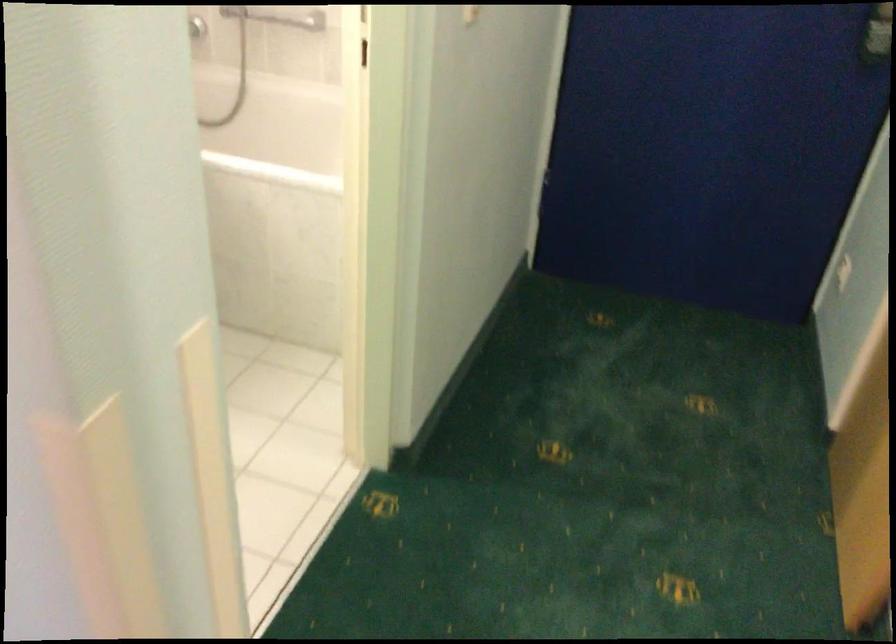
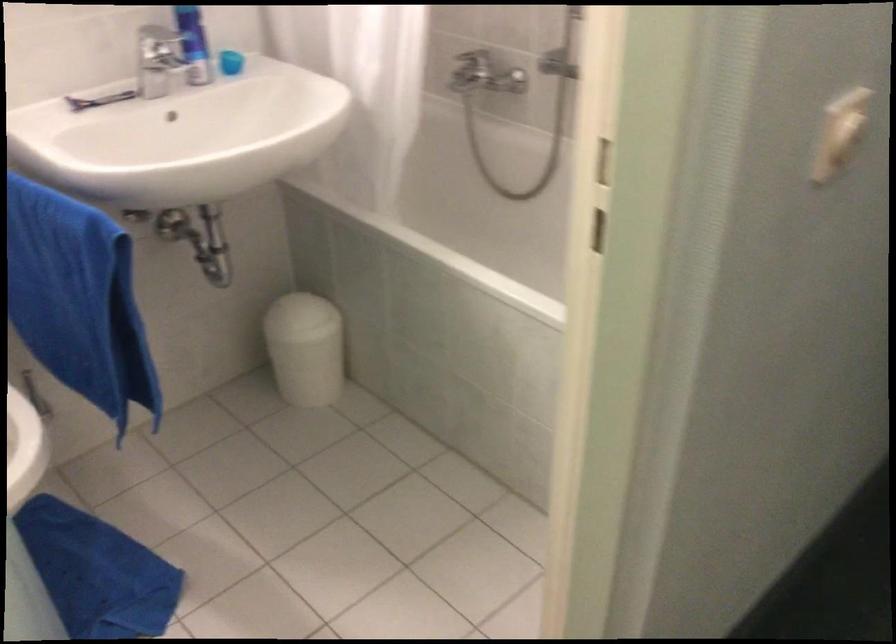
Question: How did the camera likely rotate?

Choices:
 (A) Left
 (B) Right
 (C) Up
 (D) Down

Answer: (A)